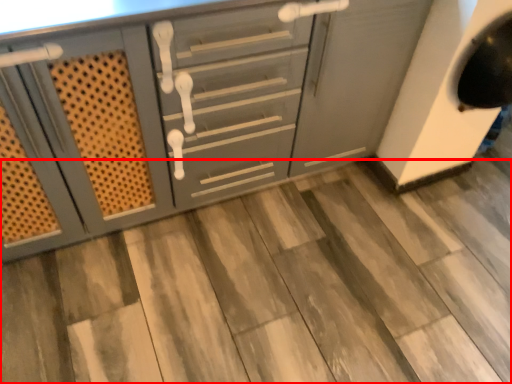
Question: From the image's perspective, where is tile (annotated by the red box) located in relation to cabinetry in the image?

Choices:
 (A) above
 (B) below

Answer: (B)